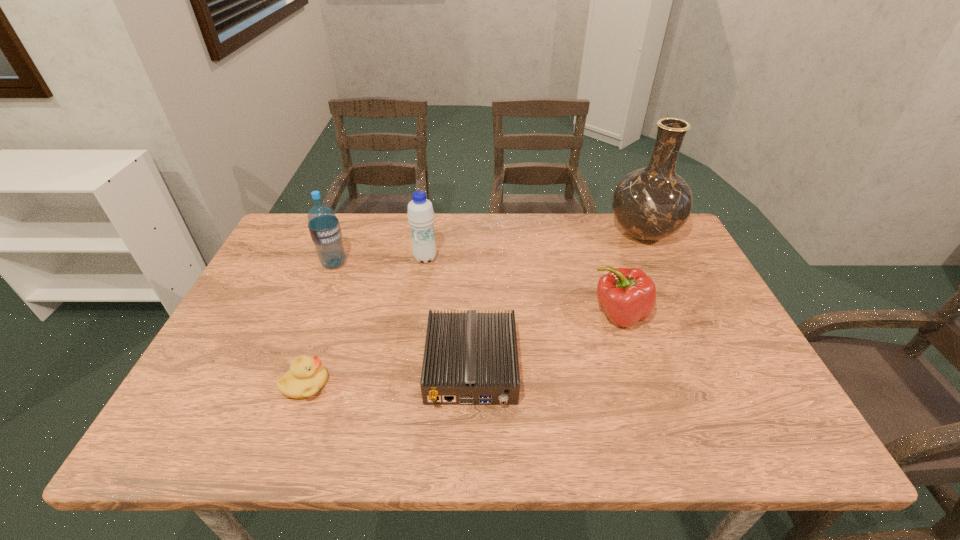
Locate an element on the screen. The height and width of the screenshot is (540, 960). free area in between the left water bottle and the vase is located at coordinates (489, 248).

Find the location of a particular element. The image size is (960, 540). vacant space that is in between the third object from left to right and the duckling is located at coordinates (366, 321).

Locate an element on the screen. object that stands as the fourth closest to the pepper is located at coordinates [306, 376].

Locate an element on the screen. The image size is (960, 540). the fourth closest object to the tallest object is located at coordinates (324, 227).

The height and width of the screenshot is (540, 960). Identify the location of free space that satisfies the following two spatial constraints: 1. on the back panel of the third object from right to left; 2. on the front-facing side of the duckling. (471, 384).

The height and width of the screenshot is (540, 960). I want to click on free region that satisfies the following two spatial constraints: 1. on the back side of the left water bottle; 2. on the right side of the right water bottle, so click(x=336, y=258).

Find the location of a particular element. This screenshot has width=960, height=540. free spot that satisfies the following two spatial constraints: 1. on the back panel of the fourth object from left to right; 2. on the front-facing side of the duckling is located at coordinates (471, 384).